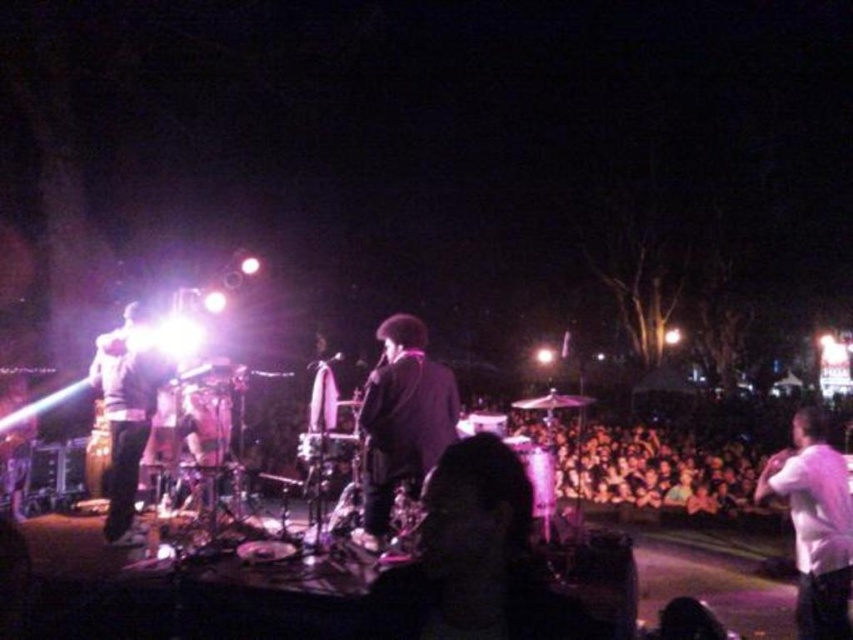
You are a photographer at the live music performance. You want to take a photo that includes both the dark hair at center and the white matte shirt at right. Based on their positions, which direction should you move your camera to ensure both are in frame?

The dark hair at center is to the left of white matte shirt at right. To include both in the frame, you should move your camera to the left to capture the dark hair at center and the white matte shirt at right.

Consider the image. You are a photographer at the music event and need to capture a clear shot of both the white matte shirt at right and the shiny silver guitar at left. Based on their heights, which object should you focus on first to ensure it doesn t get obscured?

The white matte shirt at right is shorter than the shiny silver guitar at left, so you should focus on the white matte shirt at right first to prevent it from being obscured by the taller guitar.